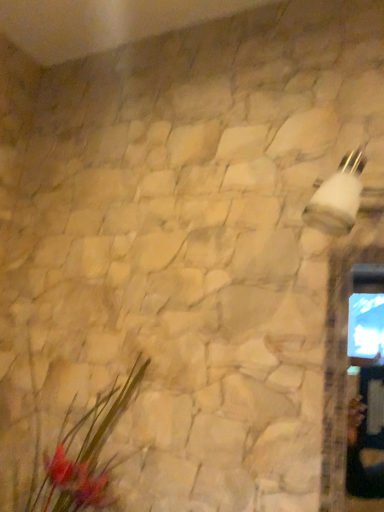
Measure the distance between point (344, 201) and camera.

Point (344, 201) is 24.41 inches away from camera.

The width and height of the screenshot is (384, 512). What do you see at coordinates (338, 197) in the screenshot? I see `white marble light fixture at upper right` at bounding box center [338, 197].

Find the location of a particular element. This screenshot has width=384, height=512. white marble light fixture at upper right is located at coordinates (338, 197).

At what (x,y) coordinates should I click in order to perform the action: click on white marble light fixture at upper right. Please return your answer as a coordinate pair (x, y). Looking at the image, I should click on (338, 197).